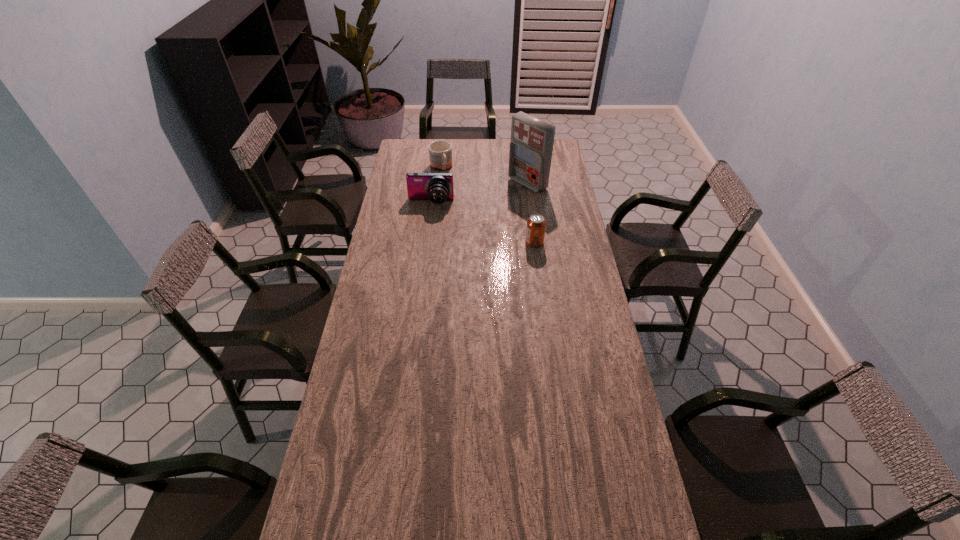
Locate an element on the screen. Image resolution: width=960 pixels, height=540 pixels. empty space between the shortest object and the tallest object is located at coordinates (484, 176).

Where is `unoccupied position between the nearest object and the tallest object`? Image resolution: width=960 pixels, height=540 pixels. unoccupied position between the nearest object and the tallest object is located at coordinates [x=531, y=213].

Find the location of `free spot between the tallest object and the can`. free spot between the tallest object and the can is located at coordinates (531, 213).

At what (x,y) coordinates should I click in order to perform the action: click on free area in between the second nearest object and the tallest object. Please return your answer as a coordinate pair (x, y). Looking at the image, I should click on (479, 193).

What are the coordinates of `vacant space that's between the tallest object and the can` in the screenshot? It's located at (531, 213).

The height and width of the screenshot is (540, 960). Identify the location of vacant space that's between the camera and the first-aid kit. (479, 193).

You are a GUI agent. You are given a task and a screenshot of the screen. Output one action in this format:
    pyautogui.click(x=<x>, y=<y>)
    Task: Click on the free space between the can and the first-aid kit
    
    Given the screenshot: What is the action you would take?
    pyautogui.click(x=531, y=213)

Identify the location of vacant area that lies between the can and the shortest object. This screenshot has height=540, width=960. (488, 205).

The image size is (960, 540). What are the coordinates of `vacant space in between the second nearest object and the can` in the screenshot? It's located at (483, 223).

Point out which object is positioned as the nearest to the shortest object. Please provide its 2D coordinates. Your answer should be formatted as a tuple, i.e. [(x, y)], where the tuple contains the x and y coordinates of a point satisfying the conditions above.

[(437, 187)]